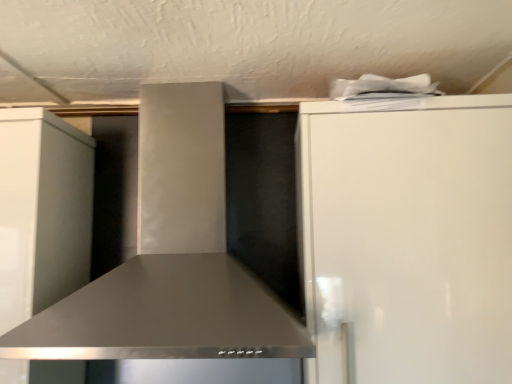
The height and width of the screenshot is (384, 512). What do you see at coordinates (408, 239) in the screenshot?
I see `white glossy refrigerator at upper right` at bounding box center [408, 239].

This screenshot has width=512, height=384. Identify the location of white glossy refrigerator at upper right. (408, 239).

Where is `satin black range hood at center`? satin black range hood at center is located at coordinates (170, 260).

This screenshot has height=384, width=512. Describe the element at coordinates (170, 260) in the screenshot. I see `satin black range hood at center` at that location.

What is the approximate width of satin black range hood at center?

19.14 inches.

Identify the location of white glossy refrigerator at upper right. The height and width of the screenshot is (384, 512). (408, 239).

Is satin black range hood at center to the left of white glossy refrigerator at upper right from the viewer's perspective?

Correct, you'll find satin black range hood at center to the left of white glossy refrigerator at upper right.

Is satin black range hood at center positioned before white glossy refrigerator at upper right?

That is True.

Is point (170, 262) farther from camera compared to point (330, 254)?

Yes, it is behind point (330, 254).

From the image's perspective, would you say satin black range hood at center is shown under white glossy refrigerator at upper right?

No, from the image's perspective, satin black range hood at center is not beneath white glossy refrigerator at upper right.

From a real-world perspective, is satin black range hood at center beneath white glossy refrigerator at upper right?

No.

Can you confirm if satin black range hood at center is wider than white glossy refrigerator at upper right?

Yes, satin black range hood at center is wider than white glossy refrigerator at upper right.

Is satin black range hood at center taller than white glossy refrigerator at upper right?

In fact, satin black range hood at center may be shorter than white glossy refrigerator at upper right.

Can you confirm if satin black range hood at center is bigger than white glossy refrigerator at upper right?

Yes, satin black range hood at center is bigger than white glossy refrigerator at upper right.

Is white glossy refrigerator at upper right completely or partially inside satin black range hood at center?

No, white glossy refrigerator at upper right is not inside satin black range hood at center.

From the picture: Is satin black range hood at center touching white glossy refrigerator at upper right?

No, satin black range hood at center is not making contact with white glossy refrigerator at upper right.

Is satin black range hood at center facing towards white glossy refrigerator at upper right?

No, satin black range hood at center is not aimed at white glossy refrigerator at upper right.

Can you tell me how much satin black range hood at center and white glossy refrigerator at upper right differ in facing direction?

The angular difference between satin black range hood at center and white glossy refrigerator at upper right is 2.33e-05 degrees.

Measure the distance between satin black range hood at center and white glossy refrigerator at upper right.

satin black range hood at center and white glossy refrigerator at upper right are 13.69 inches apart from each other.

Find the location of a particular element. refrigerator that appears below the satin black range hood at center (from the image's perspective) is located at coordinates (408, 239).

Considering the relative positions of white glossy refrigerator at upper right and satin black range hood at center in the image provided, is white glossy refrigerator at upper right to the left or to the right of satin black range hood at center?

From the image, it's evident that white glossy refrigerator at upper right is to the right of satin black range hood at center.

In the scene shown: Considering their positions, is white glossy refrigerator at upper right located in front of or behind satin black range hood at center?

Clearly, white glossy refrigerator at upper right is behind satin black range hood at center.

Considering the positions of point (341, 154) and point (220, 244), is point (341, 154) closer or farther from the camera than point (220, 244)?

Point (341, 154).

From the image's perspective, is white glossy refrigerator at upper right above satin black range hood at center?

No, from the image's perspective, white glossy refrigerator at upper right is not above satin black range hood at center.

From a real-world perspective, is white glossy refrigerator at upper right located beneath satin black range hood at center?

Correct, in the physical world, white glossy refrigerator at upper right is lower than satin black range hood at center.

Is white glossy refrigerator at upper right thinner than satin black range hood at center?

Yes.

Considering the sizes of objects white glossy refrigerator at upper right and satin black range hood at center in the image provided, who is taller, white glossy refrigerator at upper right or satin black range hood at center?

Standing taller between the two is white glossy refrigerator at upper right.

Does white glossy refrigerator at upper right have a smaller size compared to satin black range hood at center?

Indeed, white glossy refrigerator at upper right has a smaller size compared to satin black range hood at center.

Can satin black range hood at center be found inside white glossy refrigerator at upper right?

No.

Would you consider white glossy refrigerator at upper right to be distant from satin black range hood at center?

They are positioned close to each other.

Could you tell me if white glossy refrigerator at upper right is facing satin black range hood at center?

No, white glossy refrigerator at upper right is not turned towards satin black range hood at center.

Where is `home appliance lying in front of the white glossy refrigerator at upper right`? The image size is (512, 384). home appliance lying in front of the white glossy refrigerator at upper right is located at coordinates (170, 260).

In order to click on home appliance above the white glossy refrigerator at upper right (from a real-world perspective) in this screenshot , I will do `click(170, 260)`.

Image resolution: width=512 pixels, height=384 pixels. Identify the location of refrigerator that is below the satin black range hood at center (from the image's perspective). (408, 239).